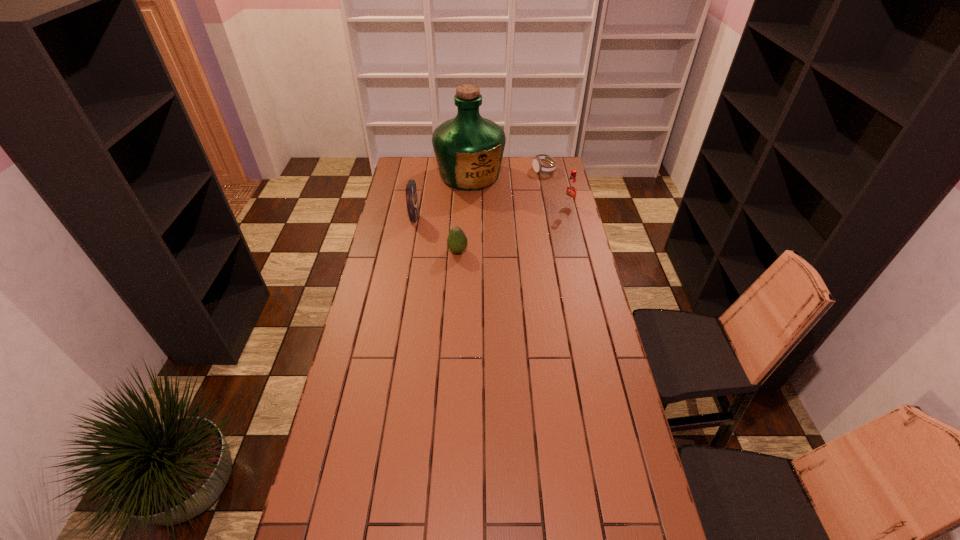
Locate an element on the screen. The height and width of the screenshot is (540, 960). free space on the desktop that is between the nearest object and the third farthest object and is positioned on the front face of the fourth farthest object is located at coordinates (520, 226).

The height and width of the screenshot is (540, 960). Find the location of `vacant space on the desktop that is between the avocado and the root beer and is positioned on the face of the shortest object`. vacant space on the desktop that is between the avocado and the root beer and is positioned on the face of the shortest object is located at coordinates (532, 221).

At what (x,y) coordinates should I click in order to perform the action: click on vacant spot on the desktop that is between the nearest object and the root beer and is positioned on the label side of the tallest object. Please return your answer as a coordinate pair (x, y). This screenshot has width=960, height=540. Looking at the image, I should click on (501, 234).